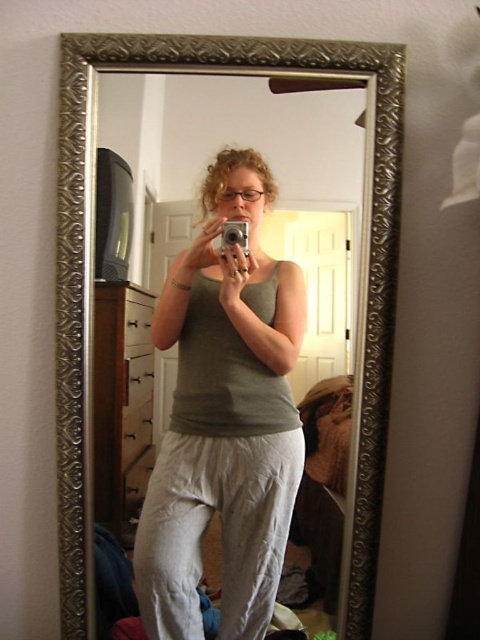
You are organizing a closet and need to decide where to place the gray cotton tank top at center and the silver metallic mirror at center. Based on their sizes, which item should you place in the smaller storage space?

The gray cotton tank top at center occupies less space than the silver metallic mirror at center, so it should be placed in the smaller storage space.

You are a fashion designer analyzing the image. You need to determine the exact location of the gray cotton tank top at center in the image. What are its coordinates?

The gray cotton tank top at center is located at coordinates point (224, 417).